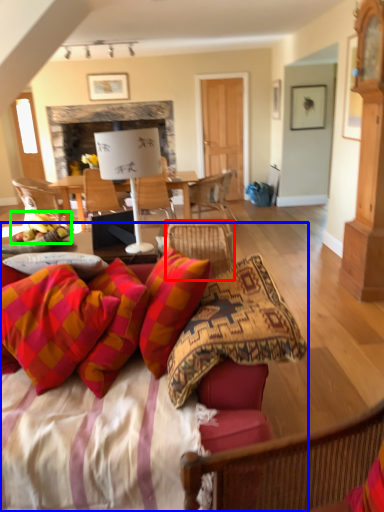
Question: Based on their relative distances, which object is farther from chair (highlighted by a red box)? Choose from studio couch (highlighted by a blue box) and fruit (highlighted by a green box).

Choices:
 (A) studio couch
 (B) fruit

Answer: (A)